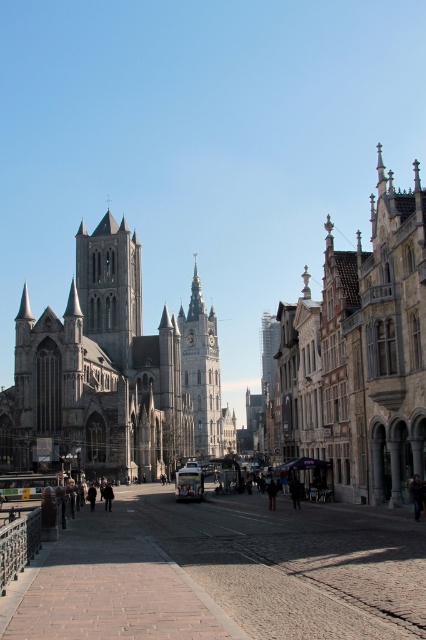
Question: Can you confirm if dark brown leather jacket at center is positioned to the left of black leather jacket at lower left?

Choices:
 (A) yes
 (B) no

Answer: (B)

Question: Which of the following is the farthest from the observer?

Choices:
 (A) black fabric person at lower left
 (B) smooth gray stone tower at center

Answer: (B)

Question: Is golden stone clock tower at center above black wool coat at center?

Choices:
 (A) yes
 (B) no

Answer: (B)

Question: Is gray stone tower at center to the left of black leather jacket at lower left from the viewer's perspective?

Choices:
 (A) yes
 (B) no

Answer: (A)

Question: Which point is farther to the camera?

Choices:
 (A) golden stone clock tower at center
 (B) gray stone tower at center
 (C) black leather jacket at lower left

Answer: (A)

Question: Which of the following is the closest to the observer?

Choices:
 (A) dark gray coat at center
 (B) cobblestone plaza at center
 (C) stone gothic church at right

Answer: (B)